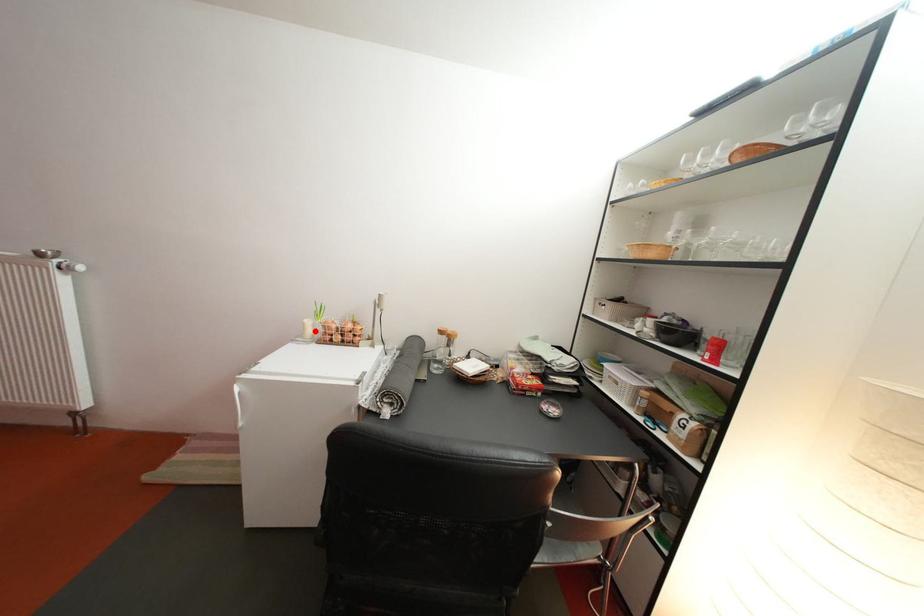
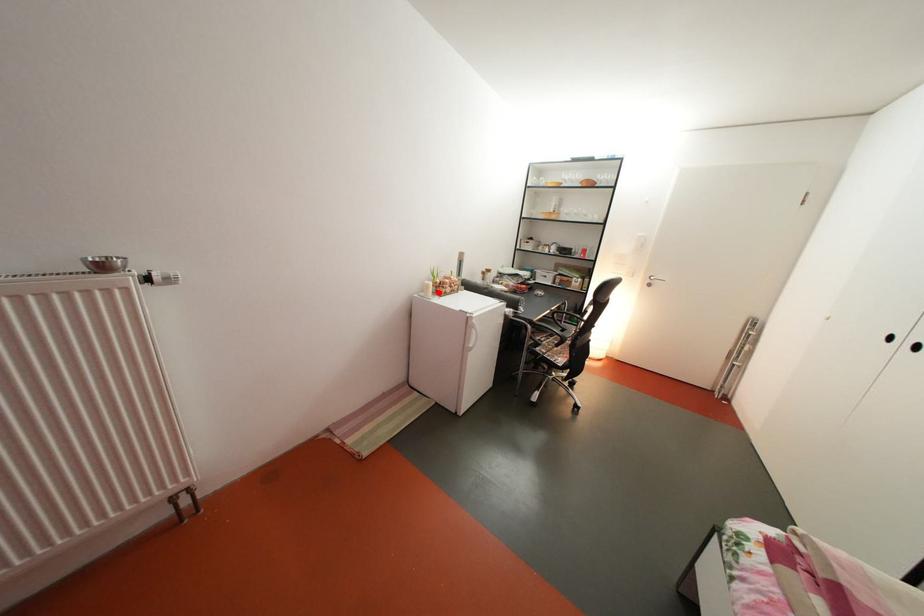
From the picture: I am providing you with two images of the same scene from different viewpoints. A red point is marked on the first image and another point is marked on the second image. Is the marked point in image1 the same physical position as the marked point in image2?

Yes